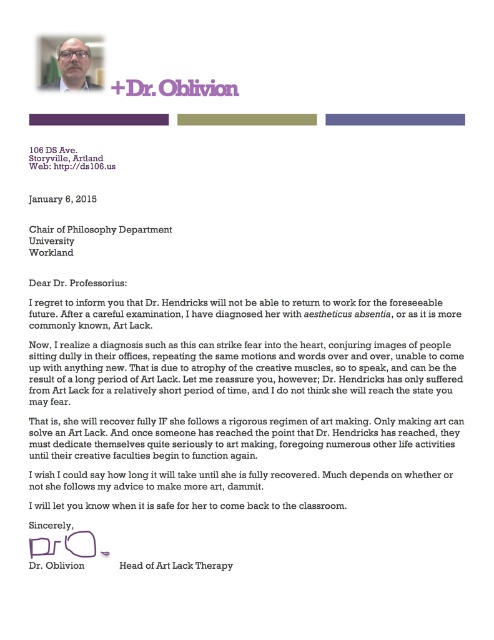
Is black paper at center thinner than white paper at upper center?

No.

Is black paper at center further to camera compared to white paper at upper center?

Yes, it is behind white paper at upper center.

Between point (41, 252) and point (50, 150), which one is positioned in front?

Point (50, 150) is more forward.

Where is `black paper at center`? black paper at center is located at coordinates (76, 234).

Is point (55, 61) less distant than point (64, 161)?

Yes, it is in front of point (64, 161).

Is matte black glasses at upper center thinner than white paper at upper center?

Yes.

Where is `matte black glasses at upper center`? The image size is (494, 640). matte black glasses at upper center is located at coordinates (72, 67).

Is point (43, 236) less distant than point (59, 84)?

No.

Find the location of a particular element. Image resolution: width=494 pixels, height=640 pixels. black paper at center is located at coordinates (76, 234).